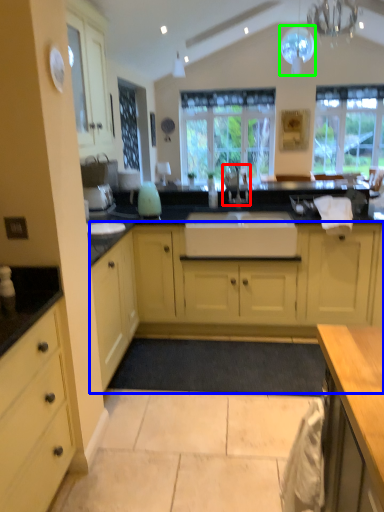
Question: Which is nearer to the faucet (highlighted by a red box)? cabinetry (highlighted by a blue box) or light fixture (highlighted by a green box).

Choices:
 (A) cabinetry
 (B) light fixture

Answer: (A)